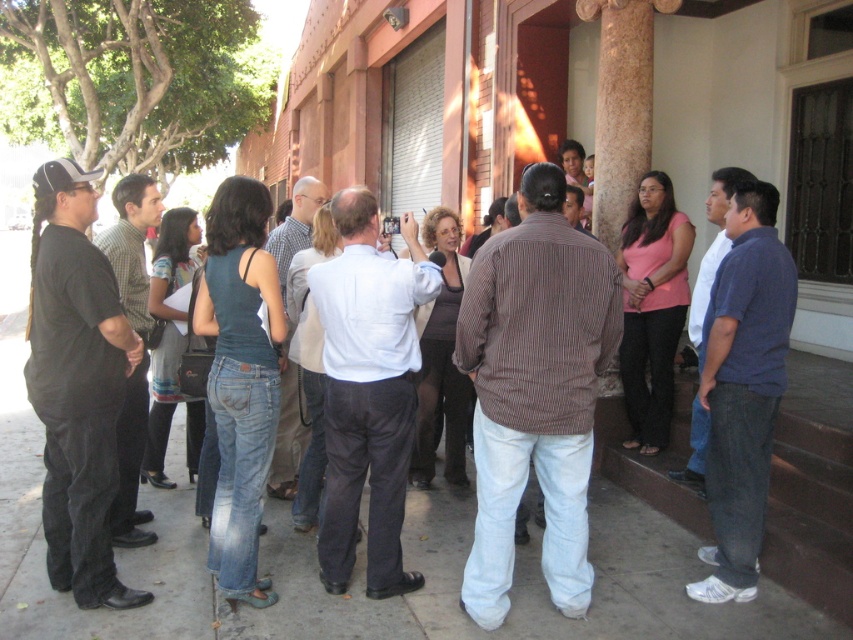
You are a photographer standing at the back of the scene. You want to capture a photo that includes both the white concrete pavement at center and the blue jeans at right. Based on their positions, which object should you focus on first to ensure both are in frame?

The white concrete pavement at center is in front of the blue jeans at right, so you should focus on the blue jeans at right first to ensure both are in frame.